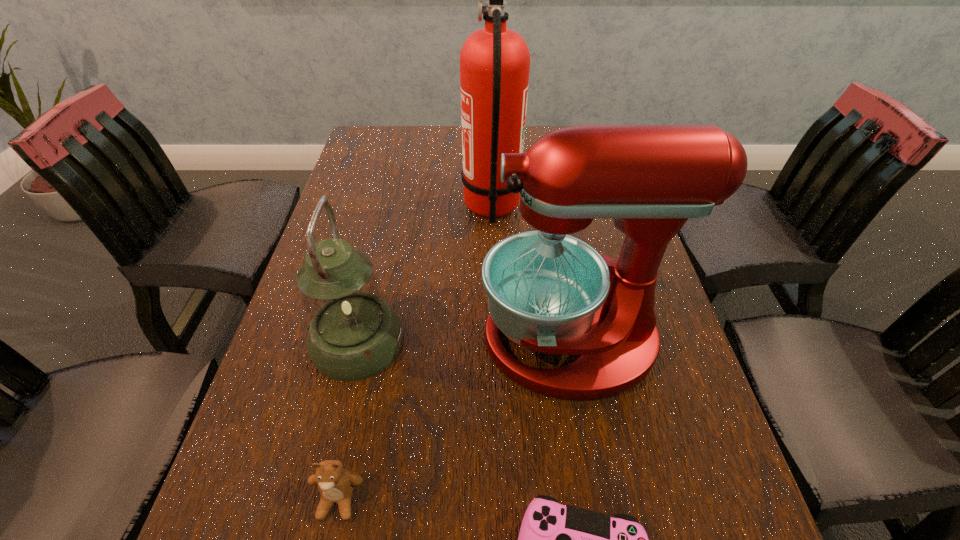
I want to click on the tallest object, so click(494, 61).

You are a GUI agent. You are given a task and a screenshot of the screen. Output one action in this format:
    pyautogui.click(x=<x>, y=<y>)
    Task: Click on the farthest object
    
    Given the screenshot: What is the action you would take?
    pyautogui.click(x=494, y=61)

The height and width of the screenshot is (540, 960). In order to click on the second tallest object in this screenshot , I will do `click(547, 291)`.

At what (x,y) coordinates should I click in order to perform the action: click on lantern. Please return your answer as a coordinate pair (x, y). The width and height of the screenshot is (960, 540). Looking at the image, I should click on (353, 334).

This screenshot has width=960, height=540. Find the location of `the second shortest object`. the second shortest object is located at coordinates (335, 484).

Locate an element on the screen. vacant space located 0.180m on the handle side of the farthest object is located at coordinates (395, 208).

Find the location of a particular element. The width and height of the screenshot is (960, 540). free space located on the handle side of the farthest object is located at coordinates (409, 208).

Locate an element on the screen. vacant point located 0.080m on the handle side of the farthest object is located at coordinates (432, 208).

Where is `free point located on the front-facing side of the mixer`? free point located on the front-facing side of the mixer is located at coordinates (304, 340).

I want to click on vacant space positioned on the front-facing side of the mixer, so click(456, 340).